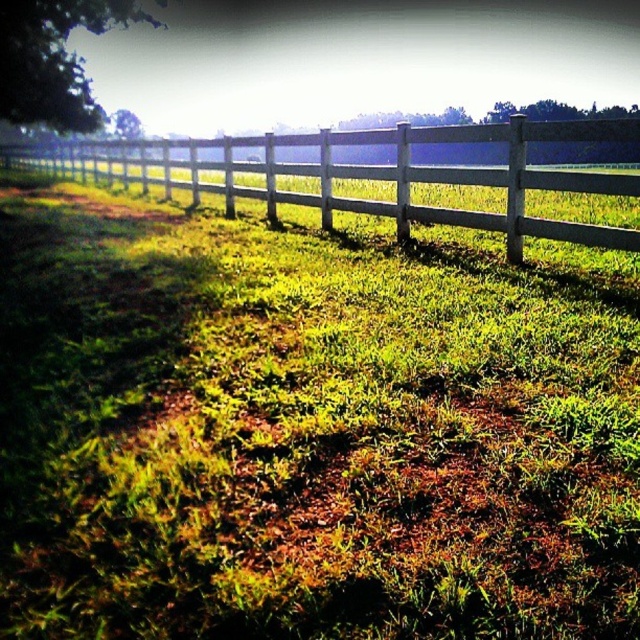
Question: Which of the following is the closest to the observer?

Choices:
 (A) green grassy at center
 (B) white wooden fence at upper center

Answer: (A)

Question: Is green grassy at center below white wooden fence at upper center?

Choices:
 (A) yes
 (B) no

Answer: (A)

Question: Is green grassy at center above white wooden fence at upper center?

Choices:
 (A) yes
 (B) no

Answer: (B)

Question: Which point is closer to the camera?

Choices:
 (A) white wooden fence at upper center
 (B) green grassy at center

Answer: (B)

Question: In this image, where is green grassy at center located relative to white wooden fence at upper center?

Choices:
 (A) above
 (B) below

Answer: (B)